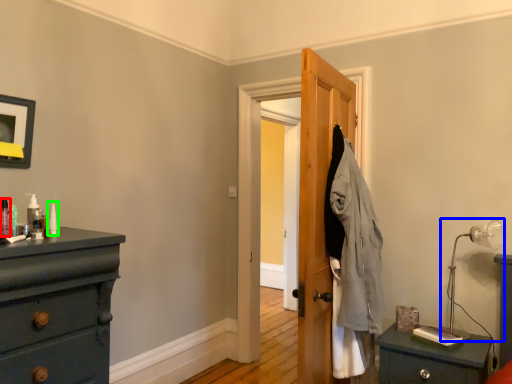
Question: Estimate the real-world distances between objects in this image. Which object is closer to toiletry (highlighted by a red box), table lamp (highlighted by a blue box) or toiletry (highlighted by a green box)?

Choices:
 (A) table lamp
 (B) toiletry

Answer: (B)